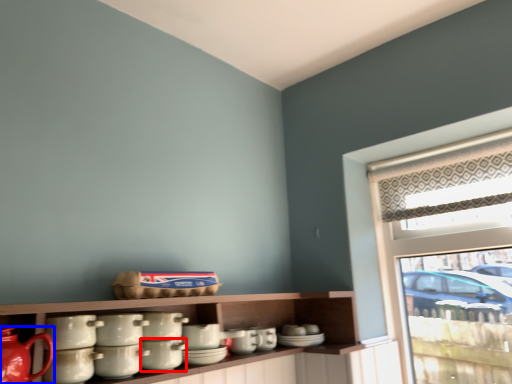
Question: Which object appears closest to the camera in this image, tableware (highlighted by a red box) or tea pot (highlighted by a blue box)?

Choices:
 (A) tableware
 (B) tea pot

Answer: (B)